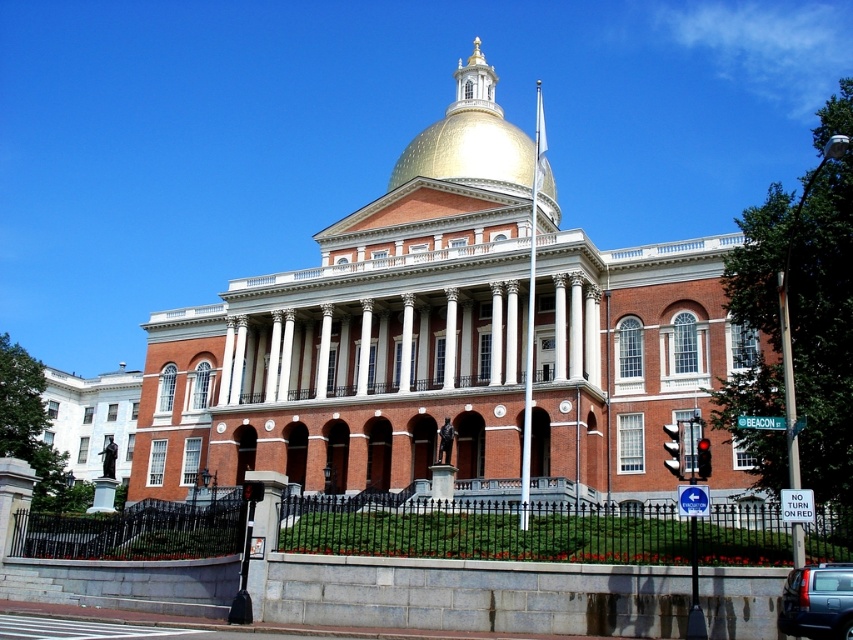
Question: Which point appears farthest from the camera in this image?

Choices:
 (A) [737, 426]
 (B) [392, 172]

Answer: (B)

Question: Which of the following is the closest to the observer?

Choices:
 (A) green metallic street sign at center
 (B) metallic gray sedan at lower right

Answer: (B)

Question: Observing the image, what is the correct spatial positioning of gold polished dome at center in reference to green metallic street sign at center?

Choices:
 (A) below
 (B) above

Answer: (B)

Question: Does gold polished dome at center lie in front of green metallic street sign at center?

Choices:
 (A) yes
 (B) no

Answer: (B)

Question: Is gold polished dome at center thinner than green metallic street sign at center?

Choices:
 (A) no
 (B) yes

Answer: (A)

Question: Which point is closer to the camera?

Choices:
 (A) metallic gray sedan at lower right
 (B) green metallic street sign at center

Answer: (A)